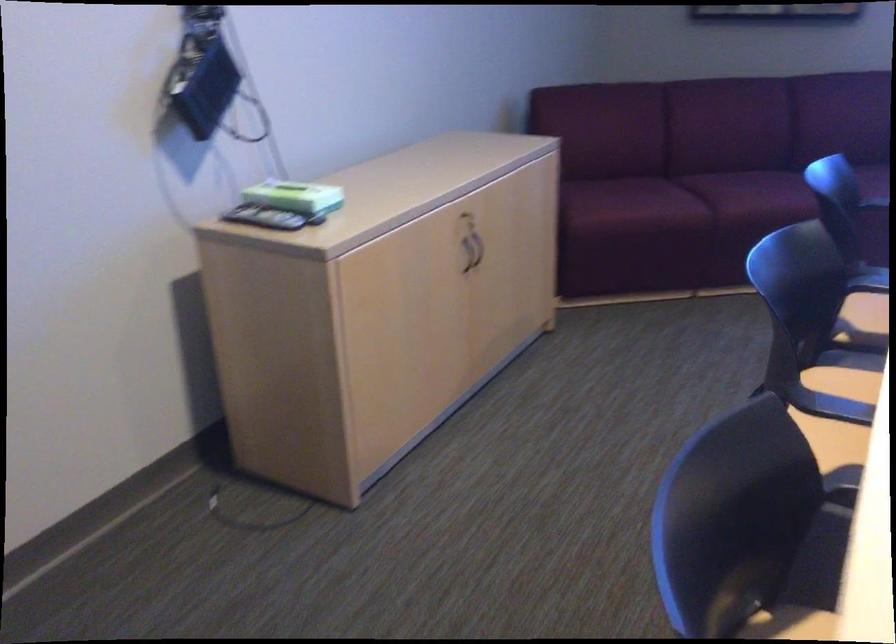
Identify the location of sofa sitting surface. (745, 198).